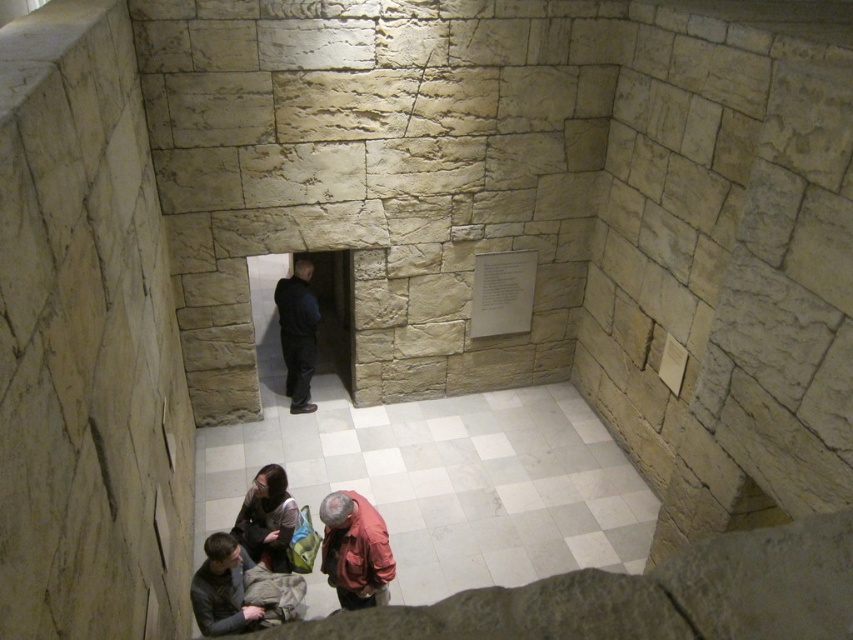
Question: Is matte black jacket at lower center bigger than dark blue fabric jacket at center?

Choices:
 (A) yes
 (B) no

Answer: (B)

Question: Estimate the real-world distances between objects in this image. Which object is farther from the white tile floor at lower center?

Choices:
 (A) matte black jacket at lower center
 (B) dark blue fabric jacket at center
 (C) dark gray sweater at lower left

Answer: (C)

Question: Can you confirm if matte black jacket at lower center is positioned to the right of dark blue fabric jacket at center?

Choices:
 (A) no
 (B) yes

Answer: (B)

Question: Which object is the farthest from the white tile floor at lower center?

Choices:
 (A) red leather jacket at lower center
 (B) dark blue fabric jacket at center
 (C) matte black jacket at lower center

Answer: (C)

Question: Which point appears closest to the camera in this image?

Choices:
 (A) (405, 588)
 (B) (271, 548)

Answer: (B)

Question: Is matte black jacket at lower center wider than dark blue fabric jacket at center?

Choices:
 (A) no
 (B) yes

Answer: (B)